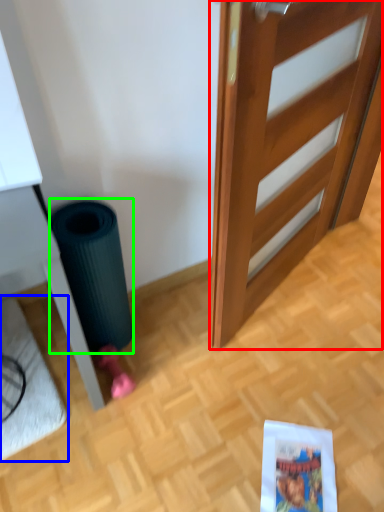
Question: Which object is positioned farthest from door (highlighted by a red box)? Select from doormat (highlighted by a blue box) and garbage (highlighted by a green box).

Choices:
 (A) doormat
 (B) garbage

Answer: (A)